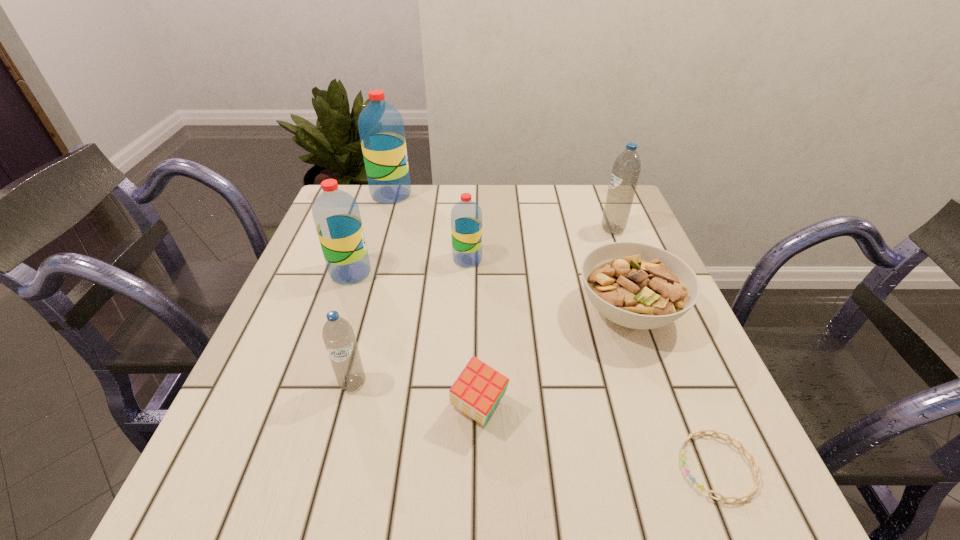
Where is `the tallest object`? This screenshot has width=960, height=540. the tallest object is located at coordinates (381, 128).

Find the location of a particular element. This screenshot has height=540, width=960. the biggest red water bottle is located at coordinates (381, 128).

Where is `the second biggest red water bottle`? The width and height of the screenshot is (960, 540). the second biggest red water bottle is located at coordinates (336, 214).

The height and width of the screenshot is (540, 960). I want to click on the rightmost water bottle, so click(626, 169).

Identify the location of the second farthest water bottle. Image resolution: width=960 pixels, height=540 pixels. (626, 169).

Identify the location of the rightmost red water bottle. (466, 216).

The width and height of the screenshot is (960, 540). Find the location of `the smallest red water bottle`. the smallest red water bottle is located at coordinates (466, 216).

Identify the location of the smaller blue water bottle. Image resolution: width=960 pixels, height=540 pixels. (338, 335).

At what (x,y) coordinates should I click in order to perform the action: click on the nearer blue water bottle. Please return your answer as a coordinate pair (x, y). This screenshot has width=960, height=540. Looking at the image, I should click on (338, 335).

Identify the location of gray stew. The width and height of the screenshot is (960, 540). (639, 286).